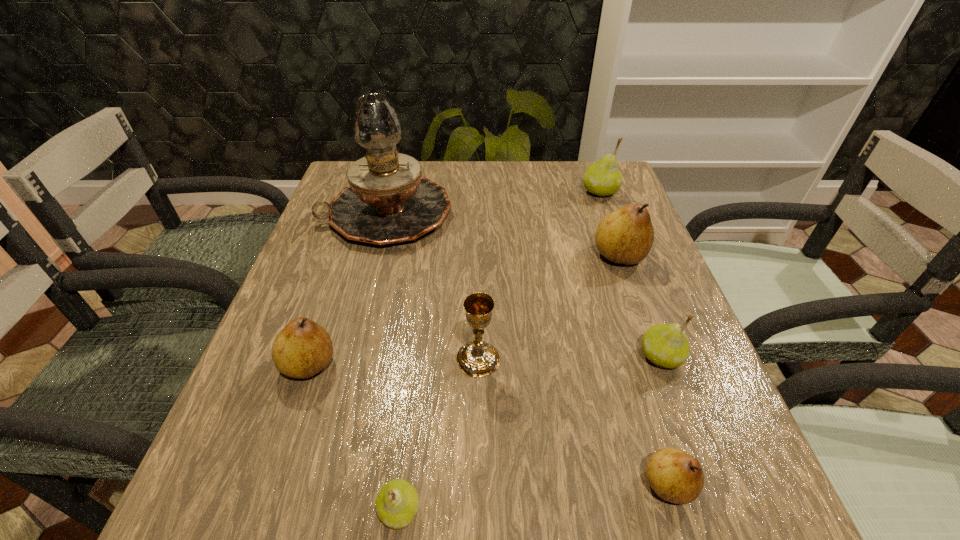
Where is `vacant space that satisfies the following two spatial constraints: 1. on the front side of the biggest brown pear; 2. on the right side of the second smallest green pear`? vacant space that satisfies the following two spatial constraints: 1. on the front side of the biggest brown pear; 2. on the right side of the second smallest green pear is located at coordinates (656, 357).

Locate an element on the screen. The width and height of the screenshot is (960, 540). free region that satisfies the following two spatial constraints: 1. on the back side of the second pear from left to right; 2. on the right side of the second smallest green pear is located at coordinates (419, 357).

I want to click on free space that satisfies the following two spatial constraints: 1. on the back side of the oil lamp; 2. on the left side of the leftmost brown pear, so click(361, 214).